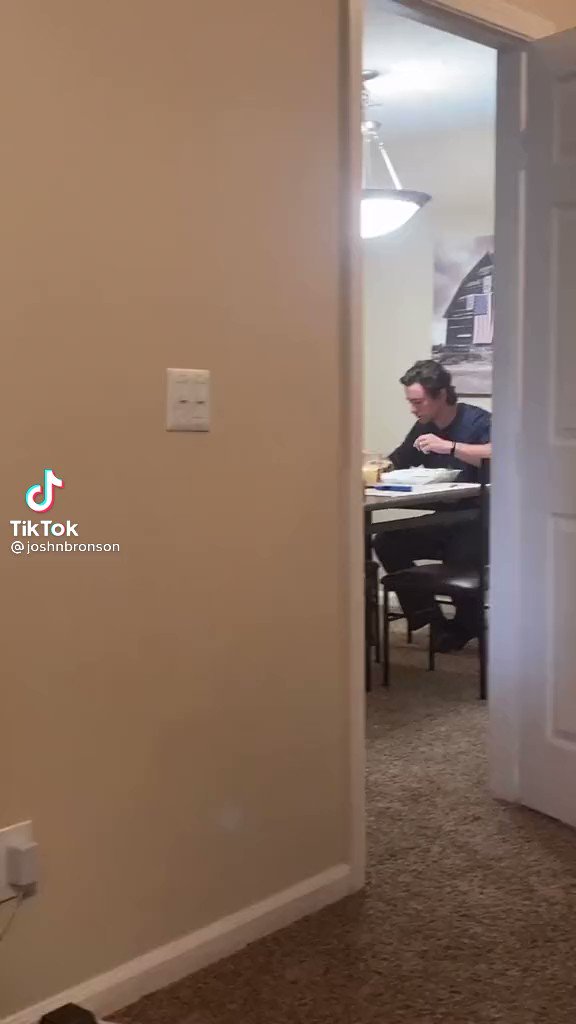
Find the location of `outlet`. outlet is located at coordinates (12, 833).